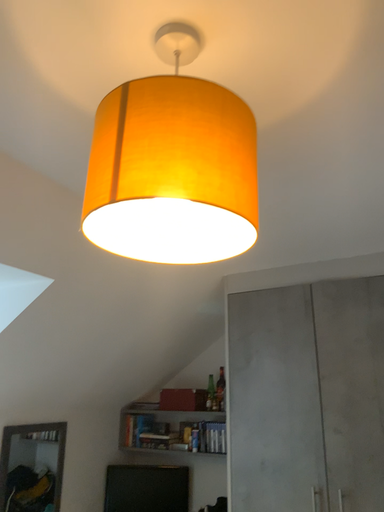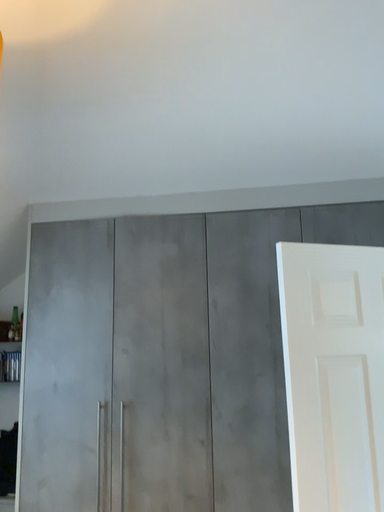
Question: How did the camera likely rotate when shooting the video?

Choices:
 (A) rotated downward
 (B) rotated upward

Answer: (A)